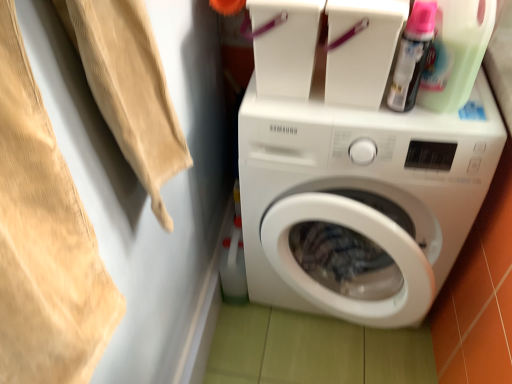
Question: Is white glossy washing machine at center surrounding beige cotton towel at upper left?

Choices:
 (A) no
 (B) yes

Answer: (A)

Question: From the image's perspective, does white glossy washing machine at center appear higher than beige cotton towel at upper left?

Choices:
 (A) no
 (B) yes

Answer: (A)

Question: From a real-world perspective, is white glossy washing machine at center positioned over beige cotton towel at upper left based on gravity?

Choices:
 (A) no
 (B) yes

Answer: (A)

Question: Considering the relative sizes of white glossy washing machine at center and beige cotton towel at upper left in the image provided, is white glossy washing machine at center bigger than beige cotton towel at upper left?

Choices:
 (A) no
 (B) yes

Answer: (B)

Question: Is white glossy washing machine at center oriented away from beige cotton towel at upper left?

Choices:
 (A) yes
 (B) no

Answer: (B)

Question: Is there a large distance between white glossy washing machine at center and beige cotton towel at upper left?

Choices:
 (A) no
 (B) yes

Answer: (A)

Question: Can you confirm if white glossy washing machine at center is thinner than translucent plastic spray can at upper right, the 2th cleaning product positioned from the right?

Choices:
 (A) yes
 (B) no

Answer: (B)

Question: Would you say white glossy washing machine at center is outside translucent plastic spray can at upper right, the 2th cleaning product positioned from the right?

Choices:
 (A) yes
 (B) no

Answer: (A)

Question: Can you confirm if white glossy washing machine at center is bigger than translucent plastic spray can at upper right, which is counted as the first cleaning product, starting from the left?

Choices:
 (A) yes
 (B) no

Answer: (A)

Question: Would you say white glossy washing machine at center is a long distance from translucent plastic spray can at upper right, which is counted as the first cleaning product, starting from the left?

Choices:
 (A) no
 (B) yes

Answer: (A)

Question: From the image's perspective, is white glossy washing machine at center on translucent plastic spray can at upper right, the 2th cleaning product positioned from the right?

Choices:
 (A) no
 (B) yes

Answer: (A)

Question: Does white glossy washing machine at center have a lesser height compared to translucent plastic spray can at upper right, which is counted as the first cleaning product, starting from the left?

Choices:
 (A) no
 (B) yes

Answer: (A)

Question: From the image's perspective, would you say translucent plastic spray can at upper right, the 2th cleaning product positioned from the right, is shown under green translucent bottle at upper right, marked as the first cleaning product in a right-to-left arrangement?

Choices:
 (A) no
 (B) yes

Answer: (B)